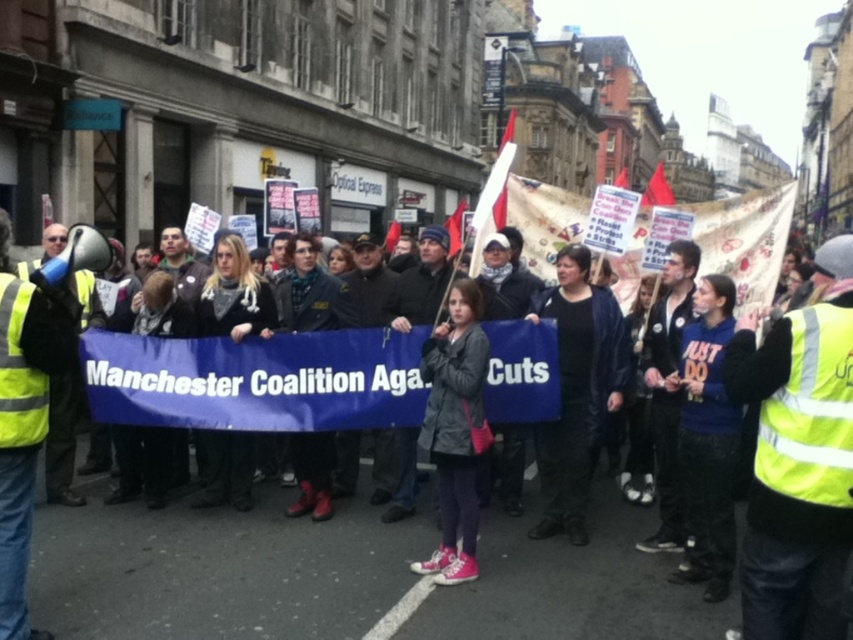
Is the position of yellow reflective vest at center more distant than that of dark gray jacket at center?

No, it is in front of dark gray jacket at center.

Does point (778, 326) lie in front of point (463, 522)?

Yes, point (778, 326) is closer to viewer.

Where is `yellow reflective vest at center`? yellow reflective vest at center is located at coordinates (798, 458).

Measure the distance between yellow reflective vest at center and black leather jacket at center.

yellow reflective vest at center is 2.68 meters from black leather jacket at center.

Does yellow reflective vest at center appear under black leather jacket at center?

Actually, yellow reflective vest at center is above black leather jacket at center.

Between point (770, 436) and point (614, 394), which one is positioned in front?

Point (770, 436) is in front.

Locate an element on the screen. Image resolution: width=853 pixels, height=640 pixels. yellow reflective vest at center is located at coordinates (798, 458).

Which is behind, point (605, 582) or point (469, 552)?

The point (469, 552) is more distant.

What do you see at coordinates (349, 577) in the screenshot?
I see `matte black jacket at center` at bounding box center [349, 577].

Does point (357, 570) come closer to viewer compared to point (480, 420)?

Yes.

Locate an element on the screen. The image size is (853, 640). matte black jacket at center is located at coordinates (349, 577).